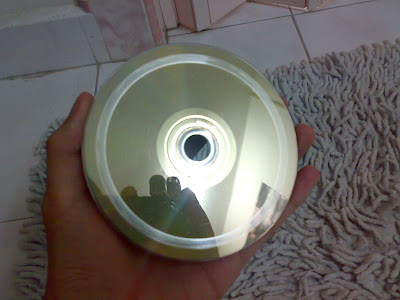
The height and width of the screenshot is (300, 400). Find the location of `rug`. rug is located at coordinates (325, 214).